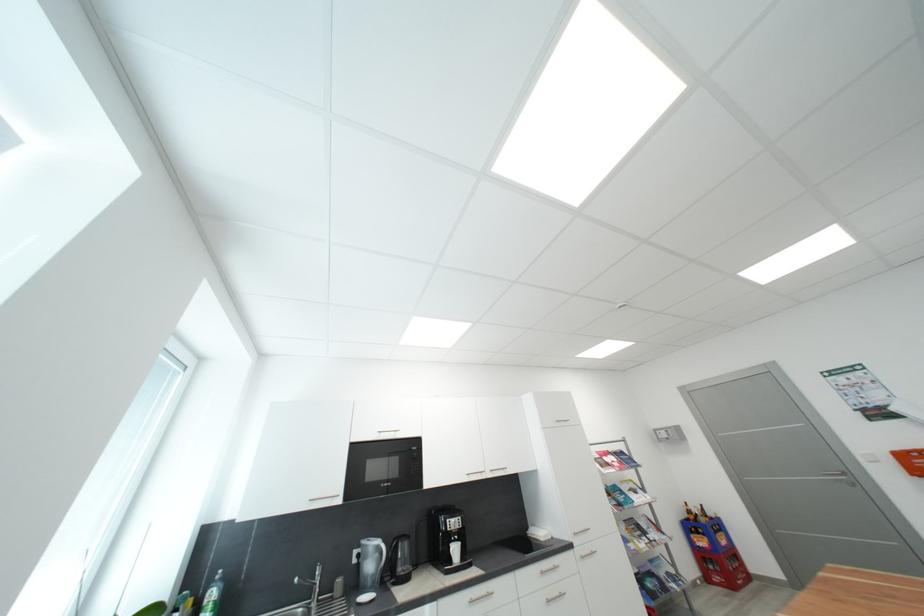
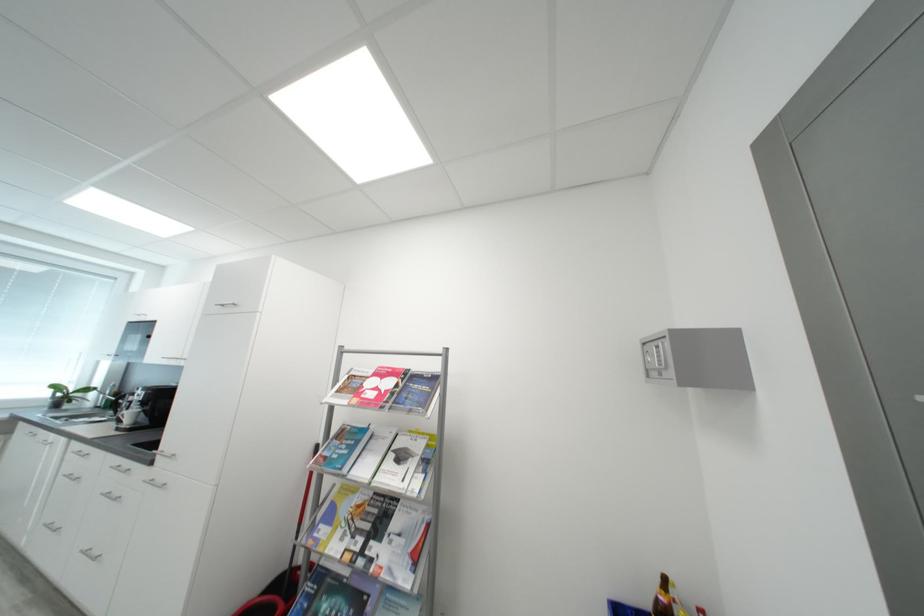
In the second image, find the point that corresponds to pixel 463 552 in the first image.

(138, 416)